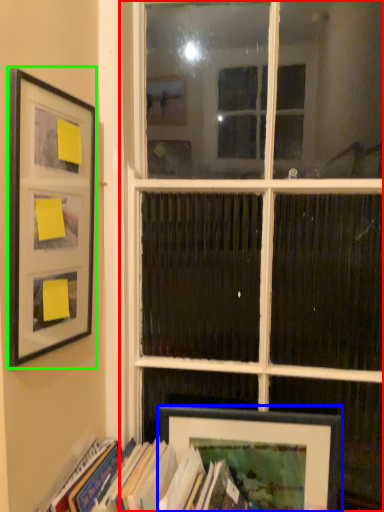
Question: Which object is positioned farthest from window (highlighted by a red box)? Select from picture frame (highlighted by a blue box) and picture frame (highlighted by a green box).

Choices:
 (A) picture frame
 (B) picture frame

Answer: (B)